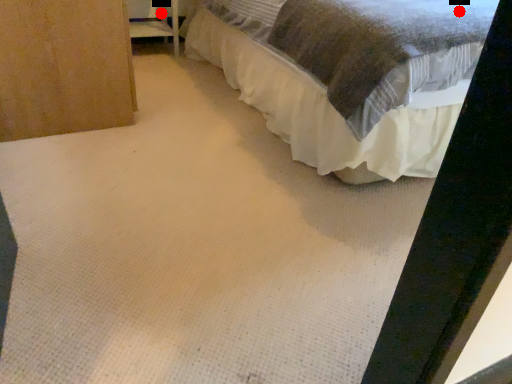
Question: Two points are circled on the image, labeled by A and B beside each circle. Which point appears farthest from the camera in this image?

Choices:
 (A) A is further
 (B) B is further

Answer: (A)